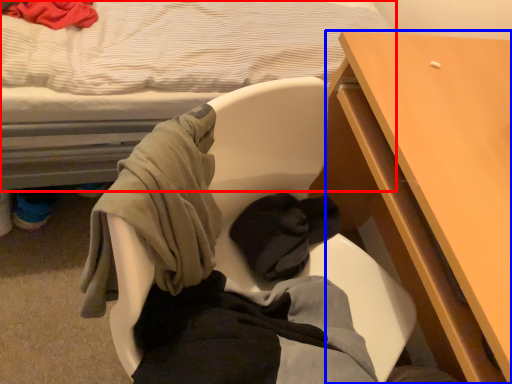
Question: Which of the following is the farthest to the observer, bed (highlighted by a red box) or desk (highlighted by a blue box)?

Choices:
 (A) bed
 (B) desk

Answer: (B)